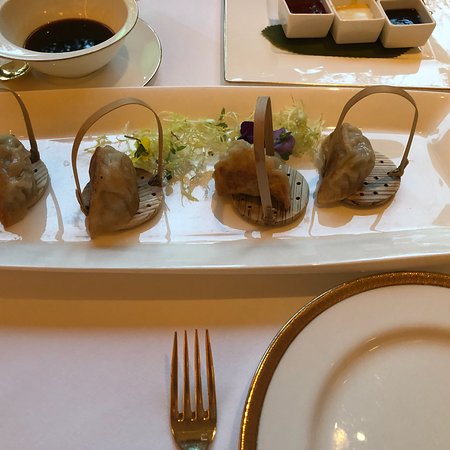
Identify the location of tray. This screenshot has width=450, height=450. (211, 206).